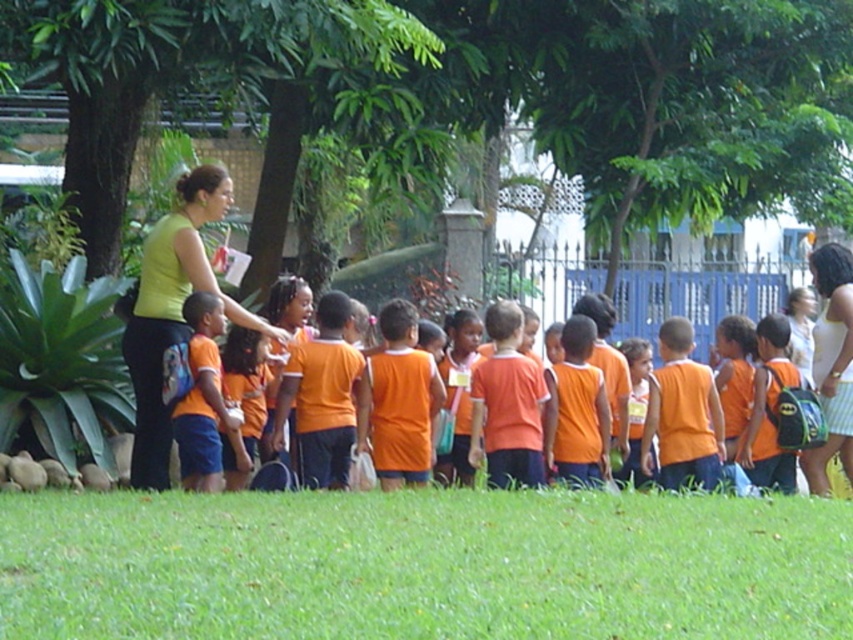
Between point (210, 173) and point (831, 356), which one is positioned in front?

Point (210, 173) is in front.

Between green matte shirt at upper left and batman-patterned backpack at right, which one is positioned higher?

Positioned higher is green matte shirt at upper left.

Locate an element on the screen. The width and height of the screenshot is (853, 640). green matte shirt at upper left is located at coordinates pyautogui.click(x=172, y=310).

Is green grass at lower center further to camera compared to green matte shirt at upper left?

No.

Can you confirm if green grass at lower center is thinner than green matte shirt at upper left?

Incorrect, green grass at lower center's width is not less than green matte shirt at upper left's.

Measure the distance between green grass at lower center and camera.

5.07 meters

Identify the location of green grass at lower center. The image size is (853, 640). (422, 564).

Between green leafy tree at upper center and green grass at lower center, which one has more height?

green leafy tree at upper center is taller.

Does point (698, 156) come in front of point (350, 515)?

No, it is not.

At what (x,y) coordinates should I click in order to perform the action: click on green leafy tree at upper center. Please return your answer as a coordinate pair (x, y). Looking at the image, I should click on [x=473, y=93].